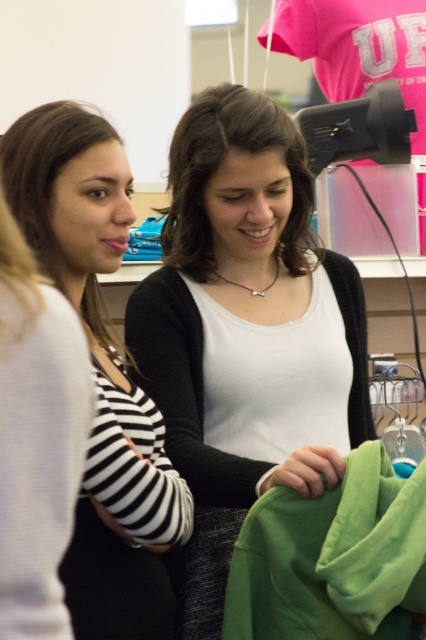
Question: Which point is closer to the camera?

Choices:
 (A) matte black shirt at left
 (B) matte black striped shirt at left
 (C) green cotton shirt at lower right

Answer: (A)

Question: Can you confirm if white matte shirt at center is bigger than brown smooth hair at left?

Choices:
 (A) no
 (B) yes

Answer: (B)

Question: Which of these objects is positioned closest to the white matte shirt at center?

Choices:
 (A) green cotton shirt at lower right
 (B) matte black shirt at left
 (C) brown smooth hair at center
 (D) matte black striped shirt at left

Answer: (C)

Question: Considering the relative positions of matte black shirt at left and brown smooth hair at center in the image provided, where is matte black shirt at left located with respect to brown smooth hair at center?

Choices:
 (A) right
 (B) left

Answer: (B)

Question: Can you confirm if matte black shirt at left is positioned to the left of brown smooth hair at center?

Choices:
 (A) yes
 (B) no

Answer: (A)

Question: Which object is the closest to the green cotton shirt at lower right?

Choices:
 (A) white matte shirt at center
 (B) matte black striped shirt at left
 (C) brown smooth hair at center

Answer: (A)